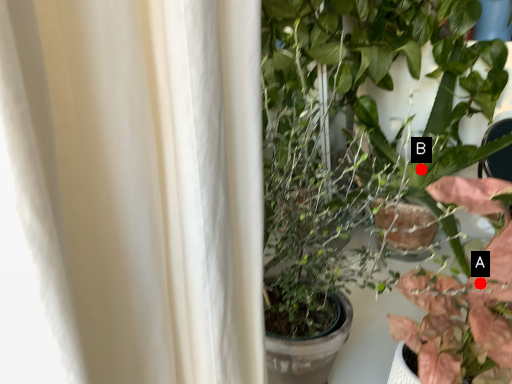
Question: Two points are circled on the image, labeled by A and B beside each circle. Which point is closer to the camera?

Choices:
 (A) A is closer
 (B) B is closer

Answer: (A)